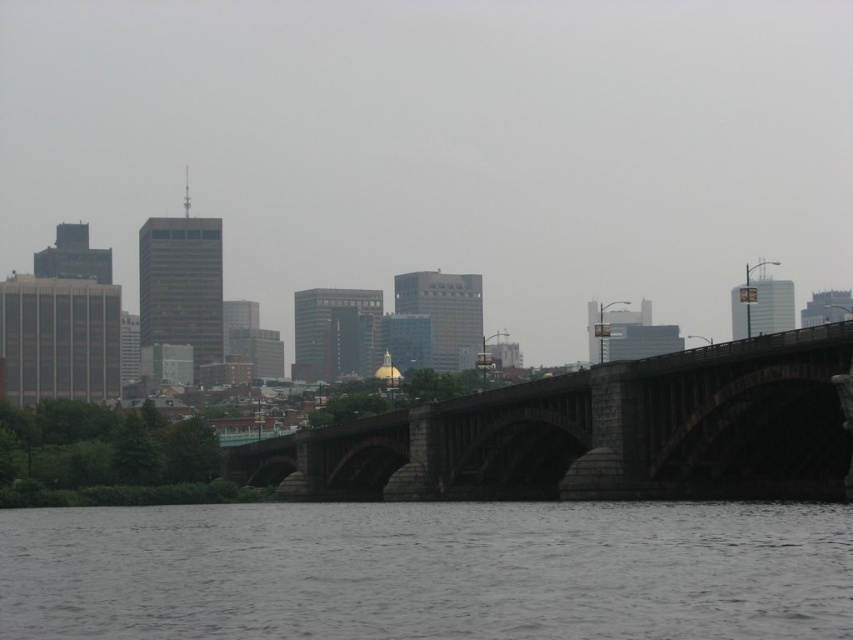
Can you confirm if gray stone bridge at lower center is positioned above dark gray stone bridge at center?

Yes.

Is point (759, 611) more distant than point (360, 448)?

No, (759, 611) is in front of (360, 448).

The width and height of the screenshot is (853, 640). Find the location of `gray stone bridge at lower center`. gray stone bridge at lower center is located at coordinates (428, 572).